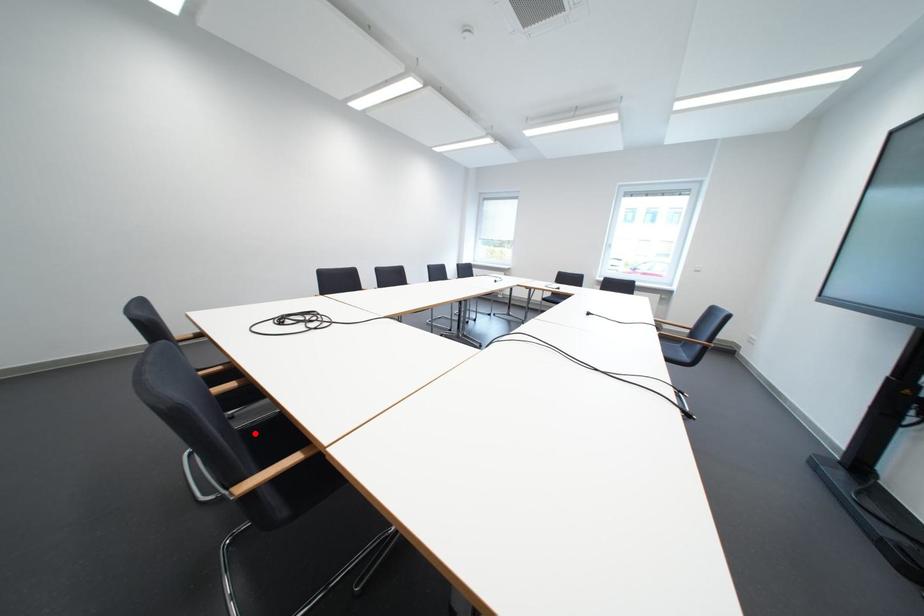
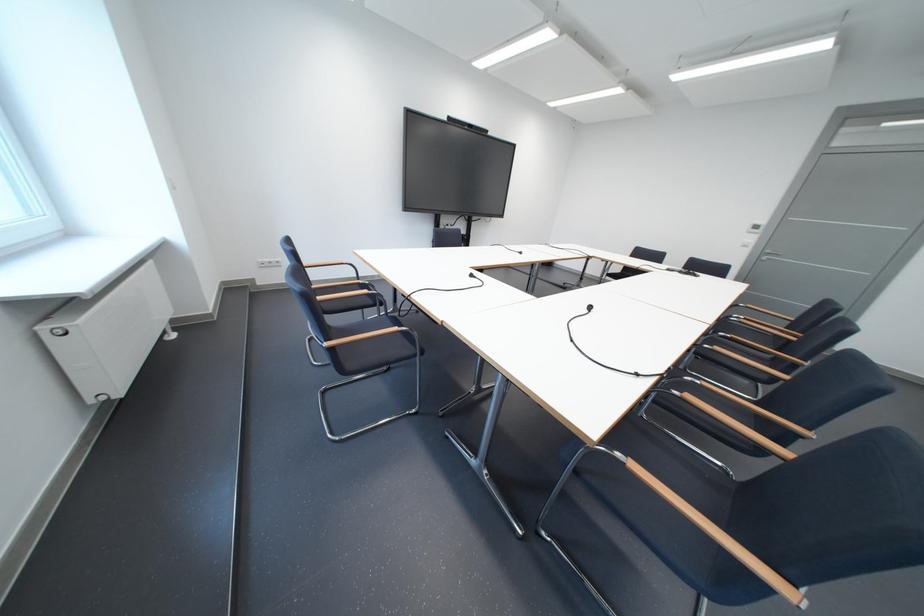
Question: I am providing you with two images of the same scene from different viewpoints. A red point is marked on the first image. Is the red point's position out of view in image 2?

Choices:
 (A) Yes
 (B) No

Answer: (A)